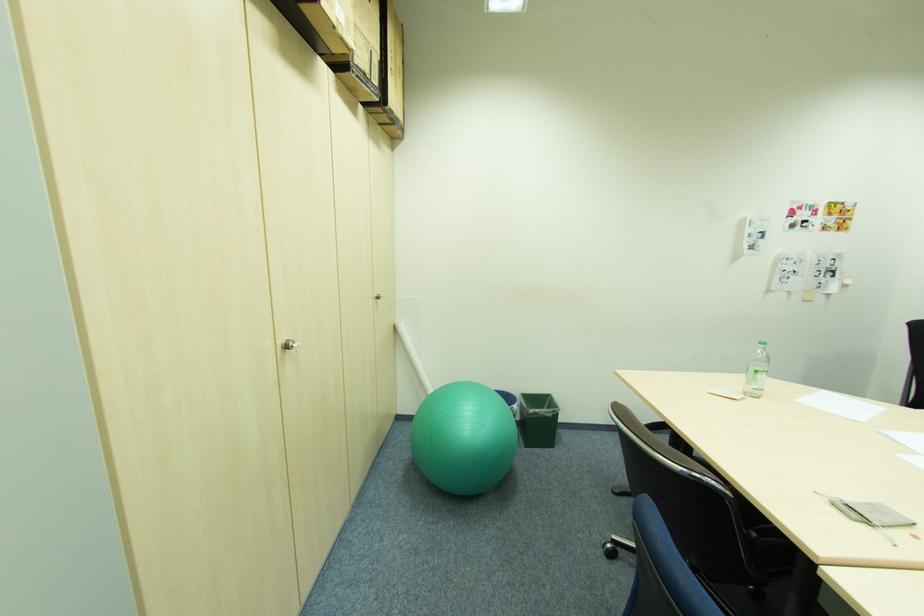
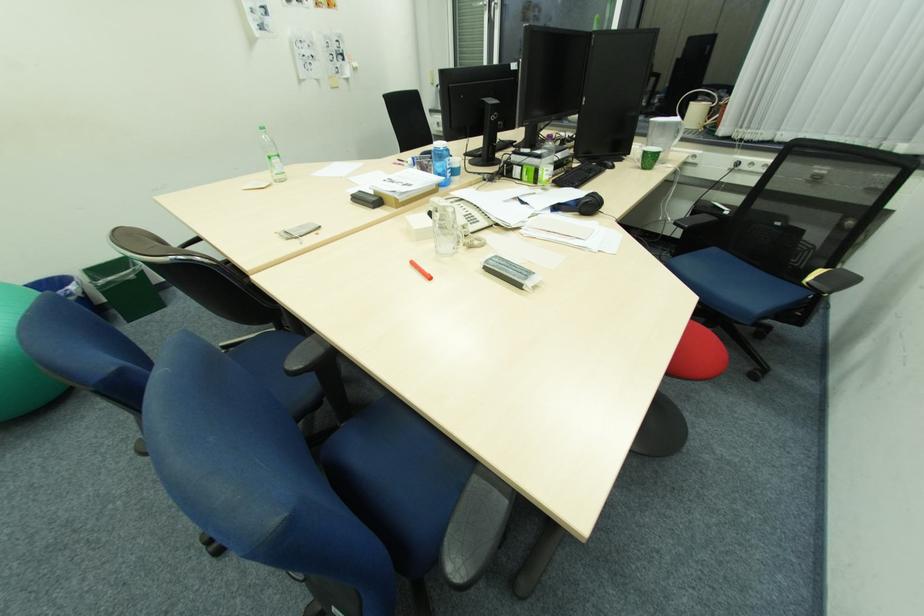
Find the pixel in the second image that matches (518,405) in the first image.

(73, 286)